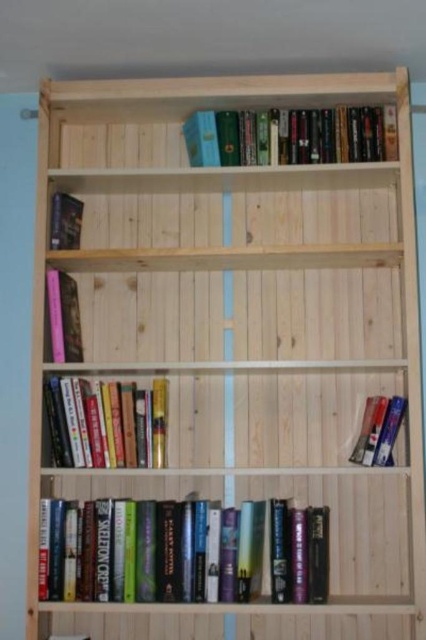
Question: Which point is farther from the camera taking this photo?

Choices:
 (A) (359, 438)
 (B) (221, 163)
 (C) (163, 557)

Answer: (B)

Question: Which point is farther from the camera taking this photo?

Choices:
 (A) (74, 209)
 (B) (68, 324)
 (C) (193, 157)
 (D) (368, 412)

Answer: (A)

Question: In this image, where is hardcover books at upper center located relative to hardcover book at right?

Choices:
 (A) left
 (B) right

Answer: (A)

Question: Which of these objects is positioned closest to the hardcover book at left?

Choices:
 (A) pink matte book at left
 (B) hardcover books at center
 (C) hardcover books at lower center

Answer: (A)

Question: Can you confirm if hardcover books at center is positioned to the right of pink matte book at left?

Choices:
 (A) yes
 (B) no

Answer: (A)

Question: Can you confirm if pink matte book at left is positioned to the right of hardcover book at right?

Choices:
 (A) yes
 (B) no

Answer: (B)